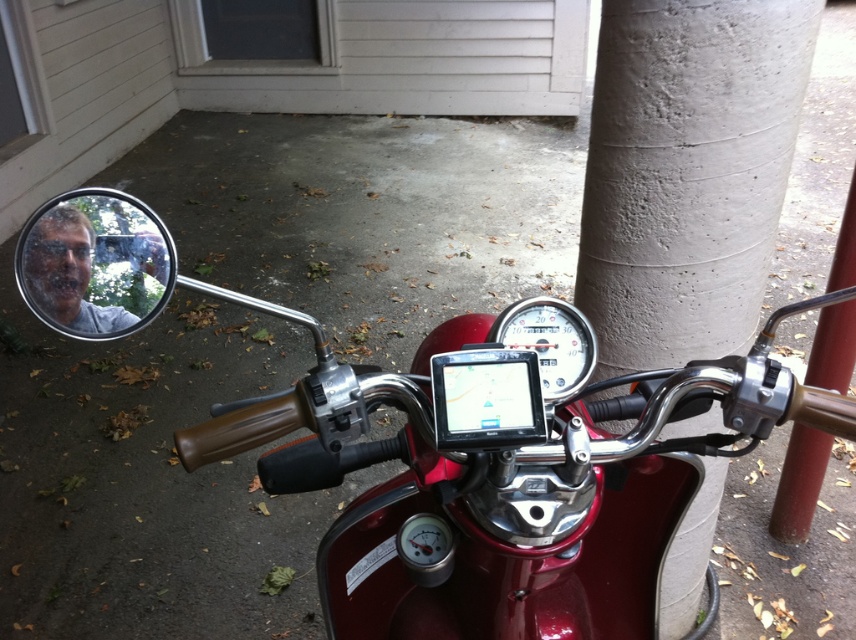
You are riding a scooter and want to check the GPS device mounted on the handlebars. If your arm is 0.8 meters long, can you comfortably reach the GPS device from the concrete at center where you are standing?

The concrete at center and camera are 1.07 meters apart from each other. Since your arm is 0.8 meters long, you cannot comfortably reach the GPS device from the concrete at center as the distance is greater than your arm length.

You are riding this scooter and want to check the road behind you. Which object would you look at to see the reflection of the road behind? The concrete at center or the clear glass mirror at upper left?

You should look at the clear glass mirror at upper left because it is a rearview mirror designed to reflect the road behind, while the concrete at center is just part of the ground and cannot provide a reflection.